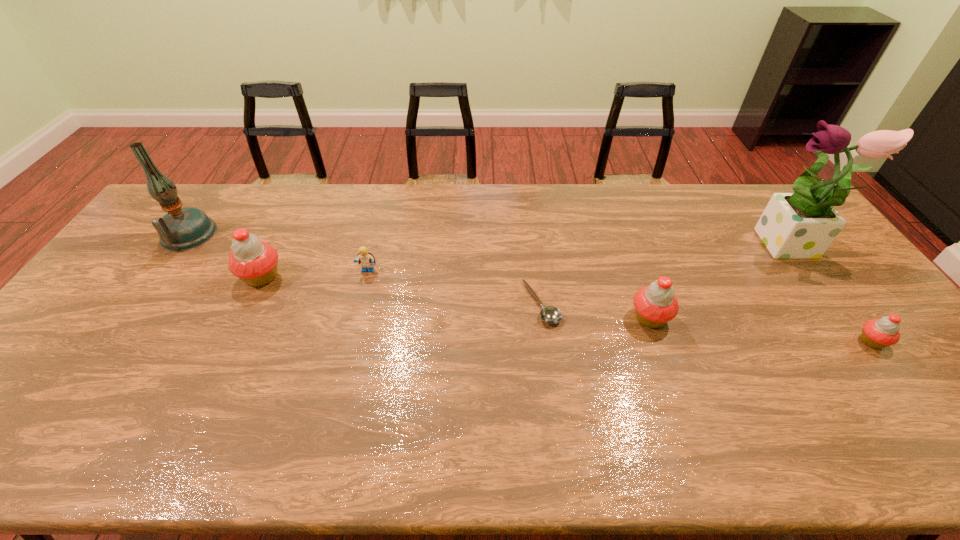
Where is `oil lamp situated at the far edge`? The width and height of the screenshot is (960, 540). oil lamp situated at the far edge is located at coordinates (180, 229).

You are a GUI agent. You are given a task and a screenshot of the screen. Output one action in this format:
    pyautogui.click(x=<x>, y=<y>)
    Task: Click on the flower arrangement that is at the far edge
    This screenshot has width=960, height=540.
    Given the screenshot: What is the action you would take?
    pyautogui.click(x=802, y=225)

Identify the location of object that is at the left edge. The height and width of the screenshot is (540, 960). (180, 229).

This screenshot has width=960, height=540. Find the location of `cupcake at the right edge`. cupcake at the right edge is located at coordinates (877, 333).

This screenshot has height=540, width=960. Identify the location of flower arrangement situated at the right edge. (802, 225).

Locate an element on the screen. This screenshot has width=960, height=540. object that is positioned at the far left corner is located at coordinates (180, 229).

What are the coordinates of `object located at the far right corner` in the screenshot? It's located at (802, 225).

The width and height of the screenshot is (960, 540). In the image, there is a desktop. What are the coordinates of `vacant region at the far edge` in the screenshot? It's located at (675, 209).

In the image, there is a desktop. Identify the location of vacant space at the near edge. click(x=623, y=406).

Where is `vacant area at the left edge`? Image resolution: width=960 pixels, height=540 pixels. vacant area at the left edge is located at coordinates (81, 351).